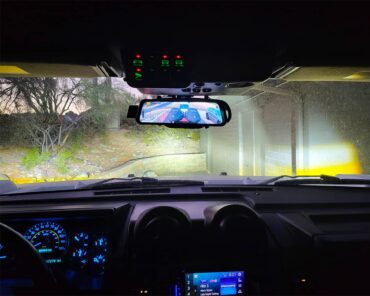
The width and height of the screenshot is (370, 296). Identify the location of ac vents. (164, 231), (237, 232).